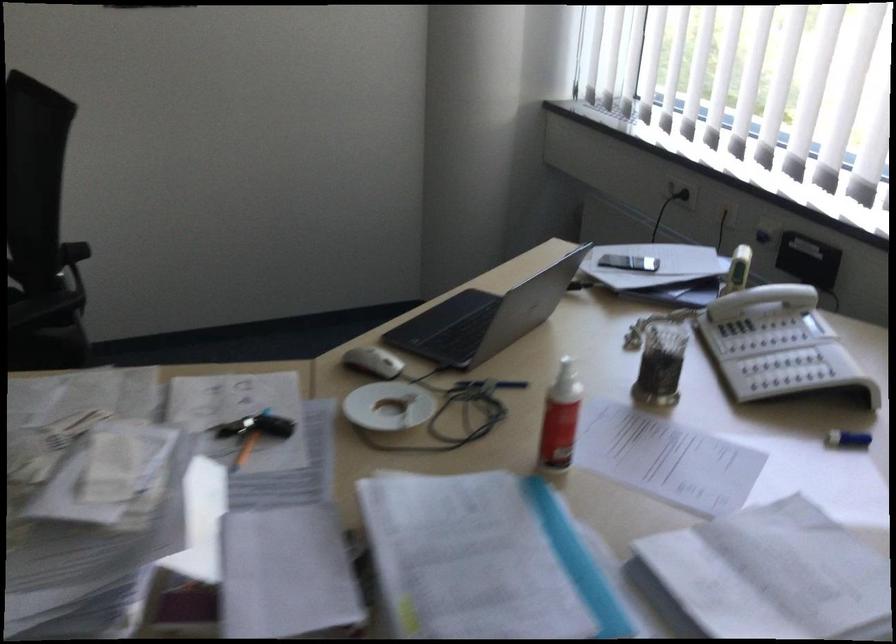
Find where to slid the white computer mouse. Please return your answer as a coordinate pair (x, y).

(373, 362)